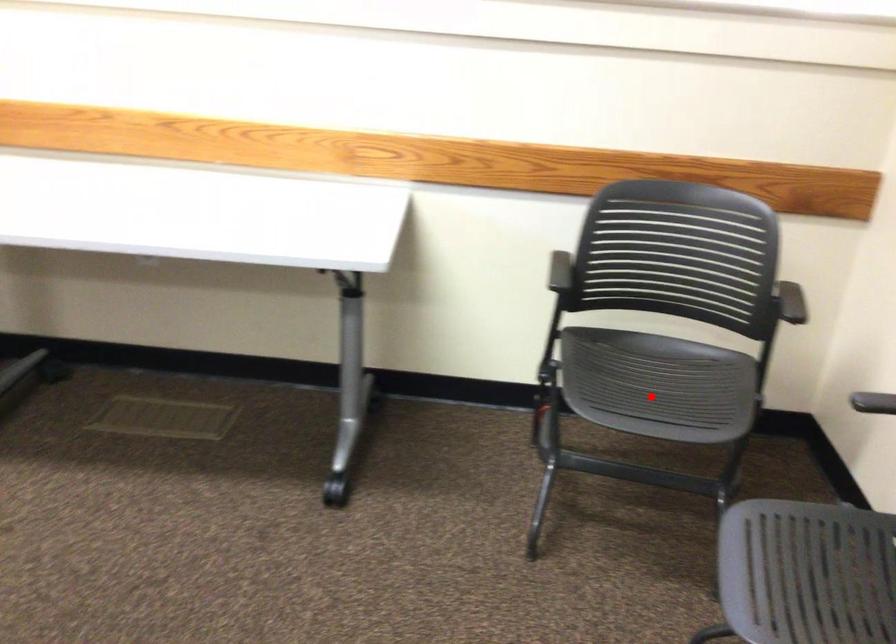
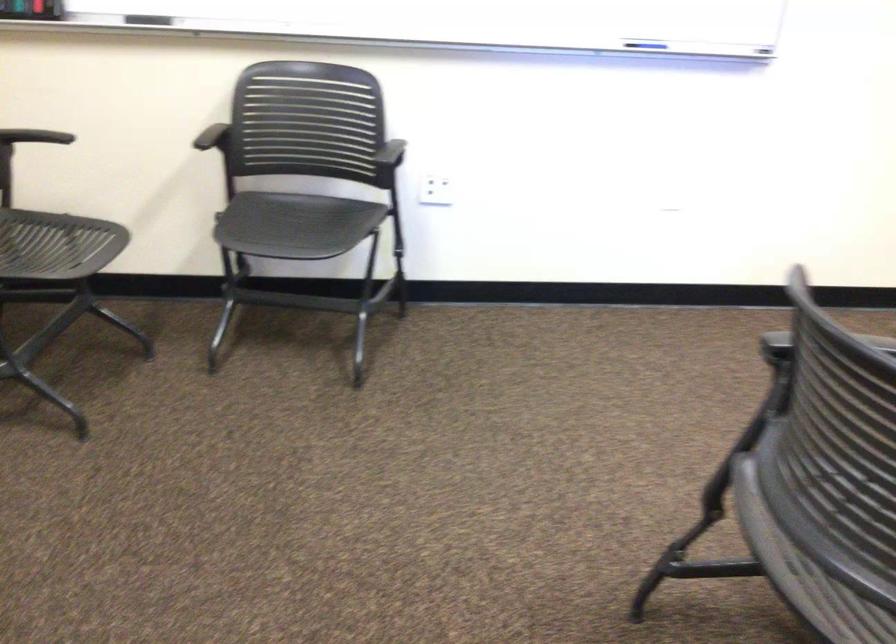
In the second image, find the point that corresponds to the highlighted location in the first image.

(56, 245)